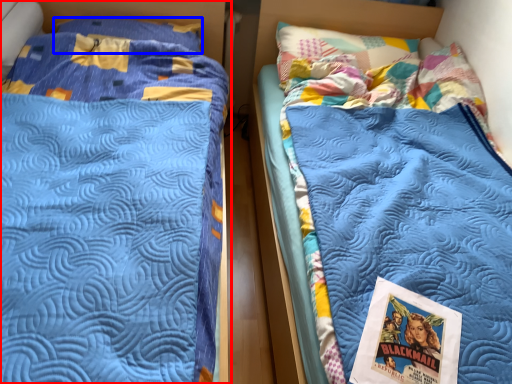
Question: Among these objects, which one is farthest to the camera, bed (highlighted by a red box) or pillow (highlighted by a blue box)?

Choices:
 (A) bed
 (B) pillow

Answer: (B)